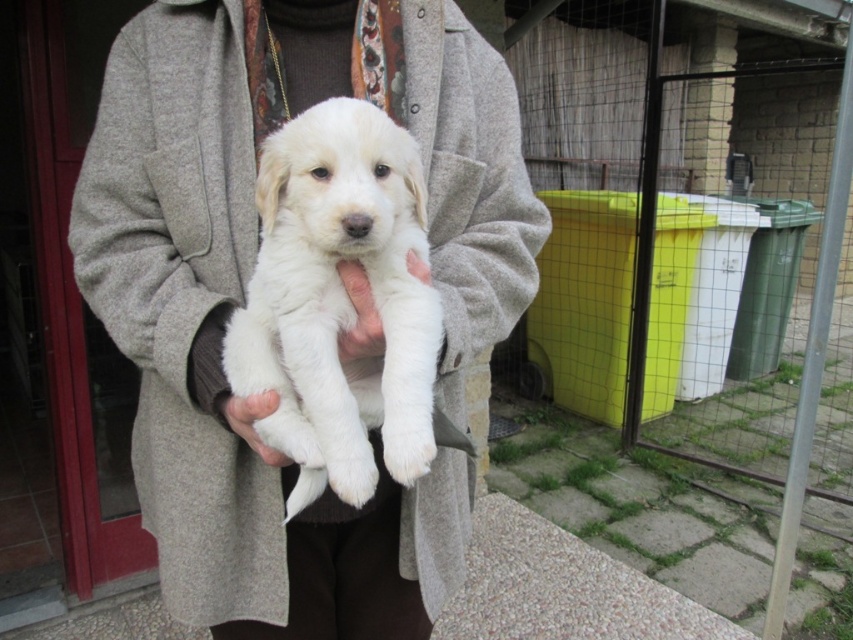
You are a photographer taking a picture of the white fur puppy at center and the white fur at center. Which one should you focus on to ensure the subject is sharp?

You should focus on the white fur puppy at center because the white fur at center is behind it, making the puppy the foreground subject.

You are a veterinarian examining the image. You notice two puppies described as white fur puppy at center and white fluffy puppy at center. Which puppy has a greater width?

The white fur puppy at center has a greater width than the white fluffy puppy at center according to the description.